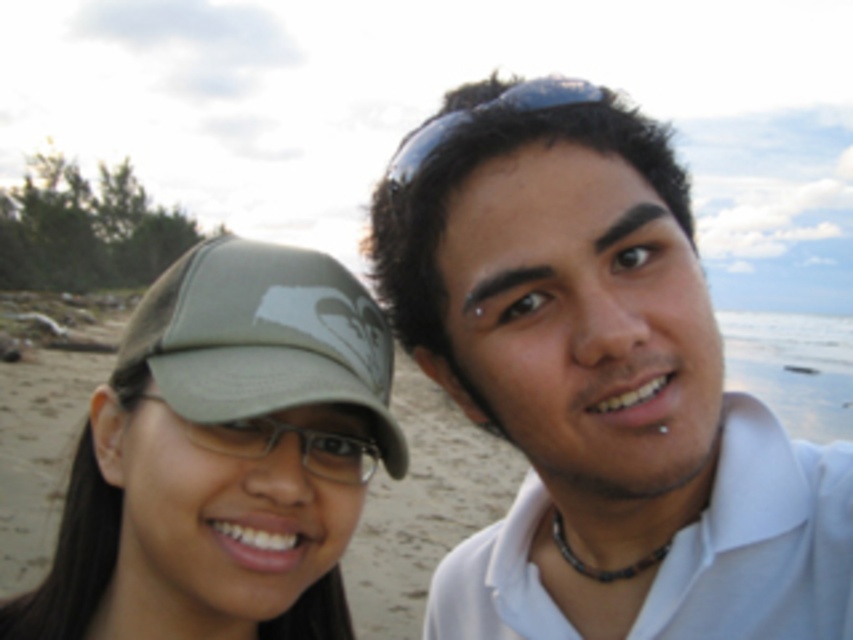
You are a photographer trying to capture both the white matte shirt at center and the matte khaki cap at left in the same frame. Based on their sizes, which object should you focus on first to ensure both are in focus?

The white matte shirt at center is much taller than the matte khaki cap at left, so focusing on the white matte shirt at center first will ensure both are in focus as it is the larger subject.

You are a photographer holding a camera and want to capture a clear photo of the white matte shirt at center. The camera has a minimum focusing distance of 30 inches. Can you take a clear photo without moving closer?

The white matte shirt at center and camera are 32.08 inches apart, which is beyond the camera minimum focusing distance of 30 inches. Therefore, you can take a clear photo without moving closer.

You are a photographer trying to capture the scene. You want to ensure that both the white matte shirt at center and the matte khaki cap at left are clearly visible in your shot. Based on their positions, which object should you focus on first to ensure both are in frame?

Since the white matte shirt at center is to the right of the matte khaki cap at left, you should focus on the matte khaki cap at left first. This ensures that as you adjust your framing, both objects remain within the camera view.